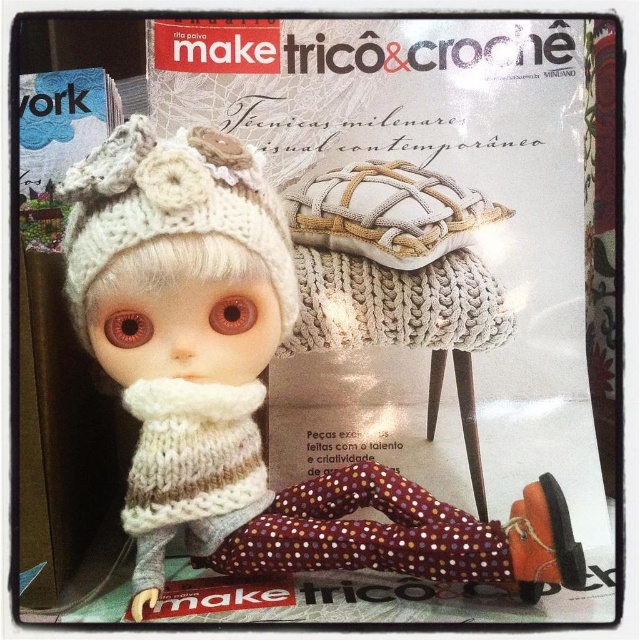
Image resolution: width=640 pixels, height=640 pixels. Find the location of `white knitted doll at center`. white knitted doll at center is located at coordinates (246, 385).

The height and width of the screenshot is (640, 640). Describe the element at coordinates (246, 385) in the screenshot. I see `white knitted doll at center` at that location.

I want to click on white knitted doll at center, so click(x=246, y=385).